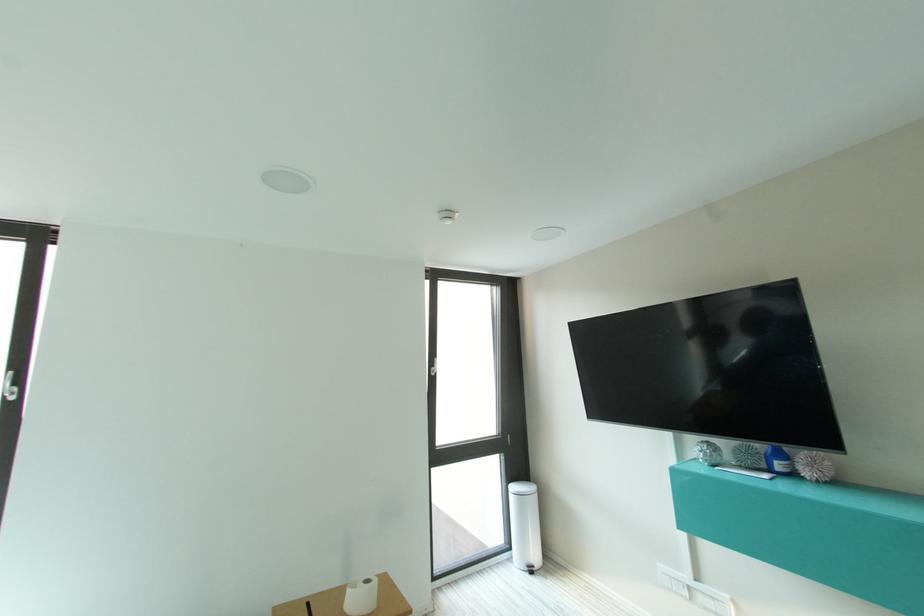
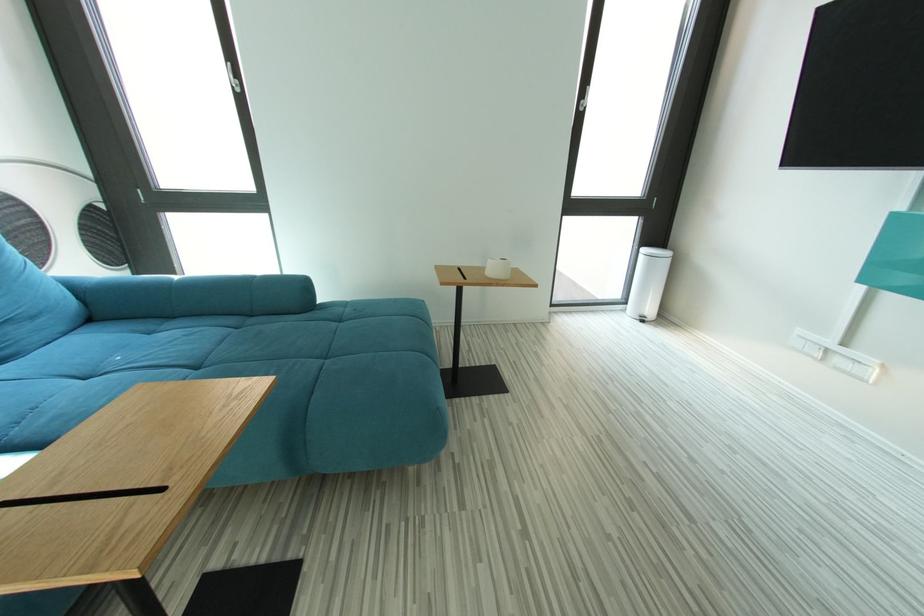
The first image is from the beginning of the video and the second image is from the end. How did the camera likely rotate when shooting the video?

The camera rotated toward left-down.